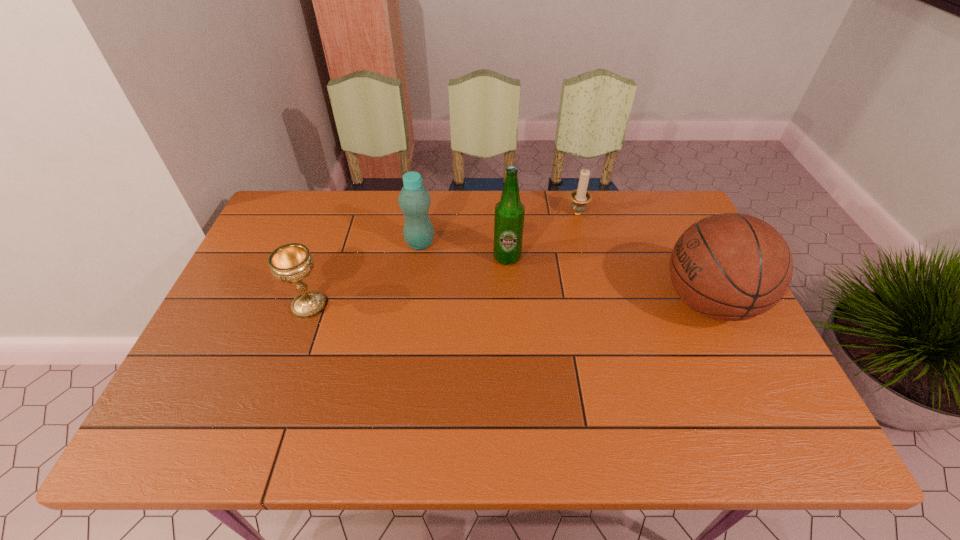
Locate an element on the screen. free space between the beer bottle and the rightmost object is located at coordinates (608, 280).

This screenshot has height=540, width=960. In order to click on free point between the beer bottle and the basketball in this screenshot , I will do `click(608, 280)`.

This screenshot has height=540, width=960. I want to click on empty space between the beer bottle and the leftmost object, so click(408, 282).

Identify the location of free space between the basketball and the water bottle. (564, 273).

Locate an element on the screen. The height and width of the screenshot is (540, 960). free space between the third object from right to left and the leftmost object is located at coordinates (408, 282).

The height and width of the screenshot is (540, 960). Identify the location of vacant region between the farthest object and the leftmost object. (444, 260).

Identify the location of free space between the beer bottle and the water bottle. The image size is (960, 540). (464, 251).

Locate an element on the screen. This screenshot has width=960, height=540. object identified as the second closest to the second object from right to left is located at coordinates (731, 267).

Select which object is the third closest to the fourth object from right to left. Please provide its 2D coordinates. Your answer should be formatted as a tuple, i.e. [(x, y)], where the tuple contains the x and y coordinates of a point satisfying the conditions above.

[(580, 197)]

Image resolution: width=960 pixels, height=540 pixels. In order to click on free point that satisfies the following two spatial constraints: 1. on the back side of the rightmost object; 2. on the side with brand label of the leftmost object in this screenshot , I will do `click(310, 302)`.